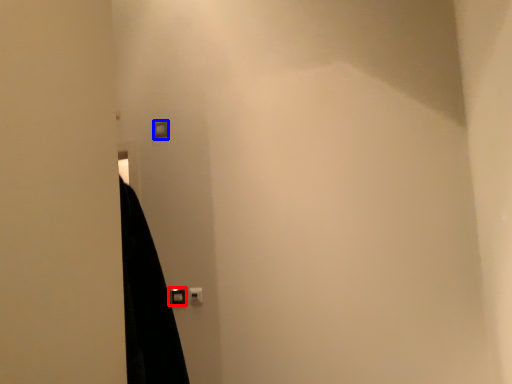
Question: Which object appears closest to the camera in this image, door handle (highlighted by a red box) or light switch (highlighted by a blue box)?

Choices:
 (A) door handle
 (B) light switch

Answer: (A)